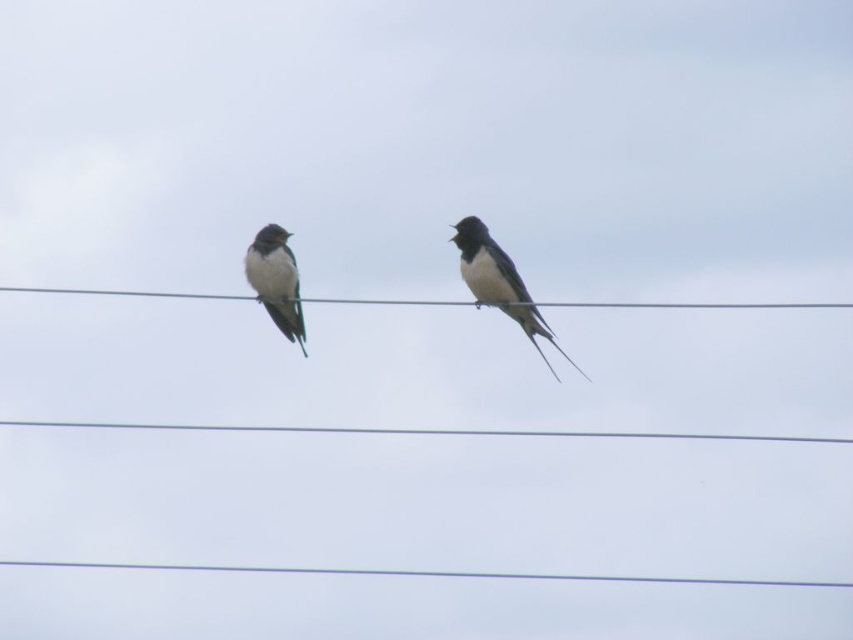
You are a birdwatcher observing the scene. You notice the metallic wire at center and the white matte bird at left. Which object is taller in this image?

The white matte bird at left is taller than the metallic wire at center.